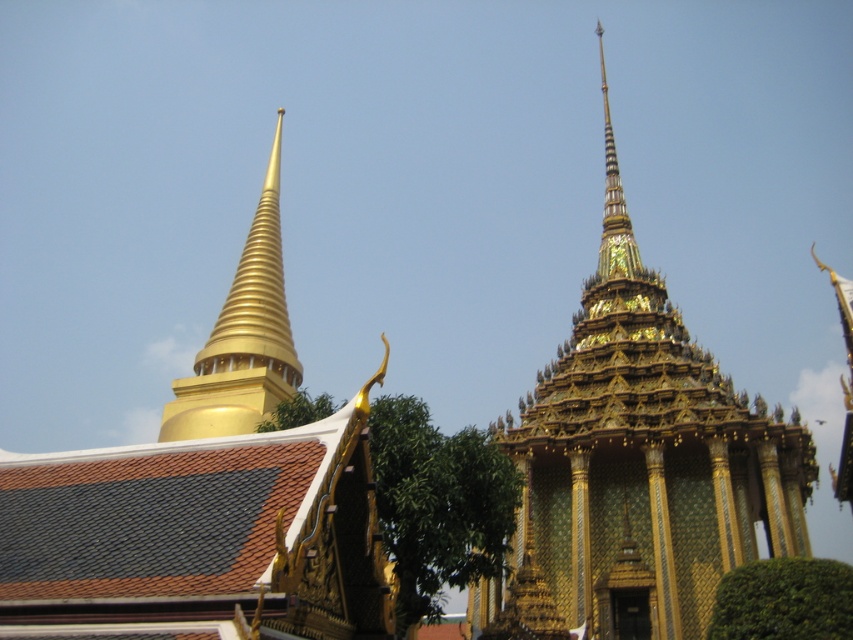
Question: Which of the following is the closest to the observer?

Choices:
 (A) (270, 186)
 (B) (526, 515)

Answer: (B)

Question: Does gold mosaic temple at center appear under gold polished spire at upper left?

Choices:
 (A) no
 (B) yes

Answer: (A)

Question: Among these objects, which one is nearest to the camera?

Choices:
 (A) gold polished spire at upper left
 (B) gold mosaic temple at center

Answer: (B)

Question: Is the position of gold mosaic temple at center more distant than that of gold polished spire at upper left?

Choices:
 (A) no
 (B) yes

Answer: (A)

Question: Is gold mosaic temple at center bigger than gold polished spire at upper left?

Choices:
 (A) yes
 (B) no

Answer: (A)

Question: Among these points, which one is nearest to the camera?

Choices:
 (A) (276, 248)
 (B) (750, 522)

Answer: (B)